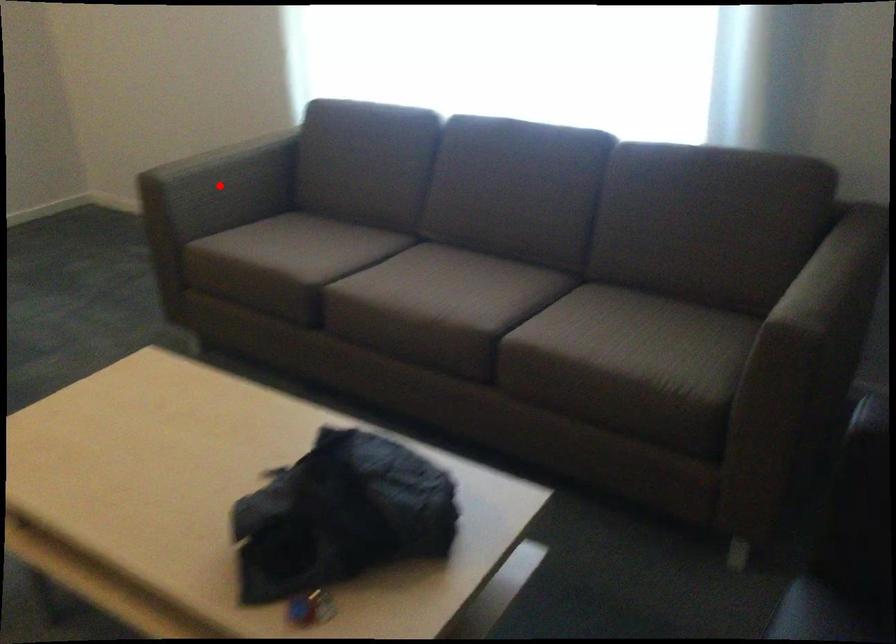
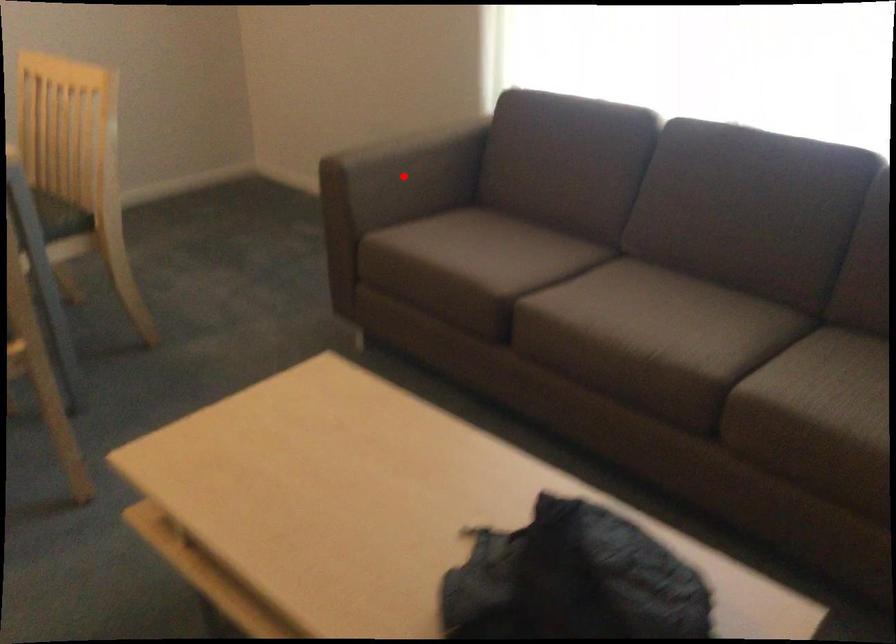
I am providing you with two images of the same scene from different viewpoints. A red point is marked on the first image and another point is marked on the second image. Do the highlighted points in image1 and image2 indicate the same real-world spot?

Yes